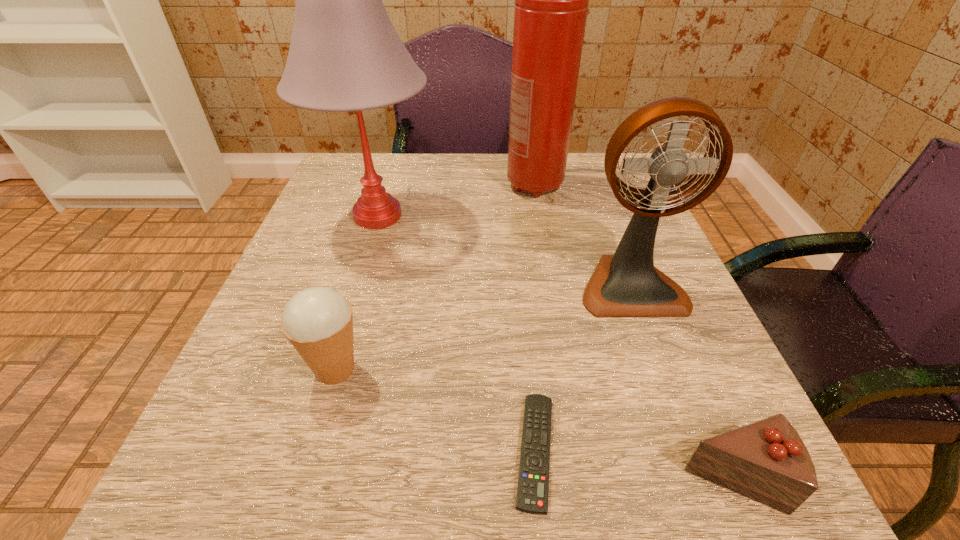
Identify the location of free area in between the table lamp and the icecream. (356, 293).

Locate an element on the screen. The image size is (960, 540). free space between the shortest object and the icecream is located at coordinates (435, 410).

Locate an element on the screen. empty location between the table lamp and the remote control is located at coordinates (456, 333).

The width and height of the screenshot is (960, 540). What are the coordinates of `empty location between the third shortest object and the table lamp` in the screenshot? It's located at (356, 293).

Locate an element on the screen. Image resolution: width=960 pixels, height=540 pixels. free area in between the shortest object and the fourth farthest object is located at coordinates (435, 410).

Find the location of a particular element. free point between the chocolate cake and the shortest object is located at coordinates (635, 463).

The height and width of the screenshot is (540, 960). Find the location of `free point between the table lamp and the chocolate cake`. free point between the table lamp and the chocolate cake is located at coordinates (556, 346).

Identify the location of the third closest object relative to the fire extinguisher. The width and height of the screenshot is (960, 540). (318, 321).

Select which object appears as the fourth closest to the table lamp. Please provide its 2D coordinates. Your answer should be formatted as a tuple, i.e. [(x, y)], where the tuple contains the x and y coordinates of a point satisfying the conditions above.

[(533, 480)]

I want to click on free spot that satisfies the following two spatial constraints: 1. on the front side of the chocolate cake; 2. on the left side of the remote control, so click(538, 476).